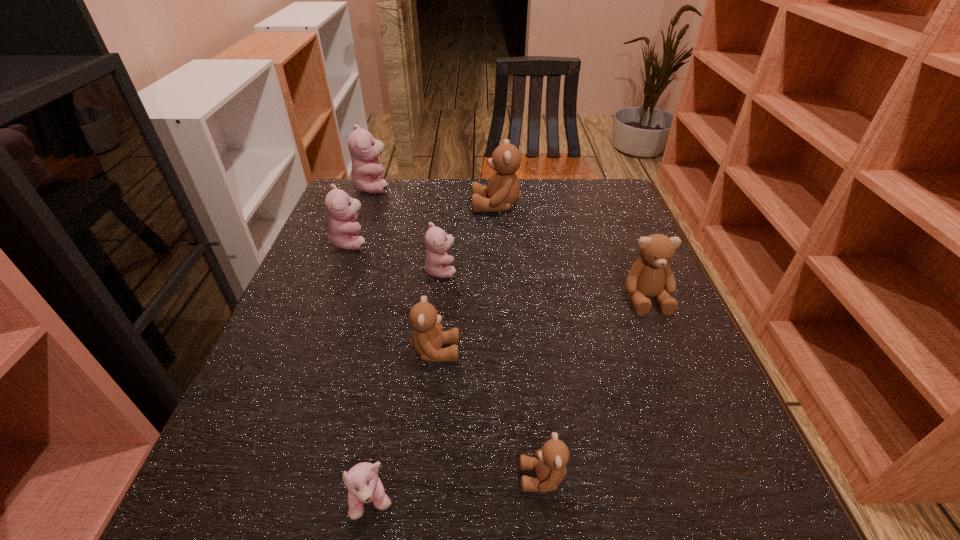
I want to click on the nearest brown teddy bear, so click(550, 462).

I want to click on the smallest pink teddy bear, so pos(364,486).

Identify the location of blank space located at the face of the farthest pink teddy bear. (472, 187).

The height and width of the screenshot is (540, 960). Identify the location of vacant space located on the front-facing side of the biggest brown teddy bear. (419, 206).

The image size is (960, 540). In order to click on vacant region located on the front-facing side of the biggest brown teddy bear in this screenshot , I will do `click(375, 206)`.

Where is `vacant space located on the front-facing side of the biggest brown teddy bear`? The width and height of the screenshot is (960, 540). vacant space located on the front-facing side of the biggest brown teddy bear is located at coordinates (425, 206).

This screenshot has width=960, height=540. Identify the location of vacant space positioned 0.220m at the face of the third farthest object. tap(457, 242).

At what (x,y) coordinates should I click in order to perform the action: click on vacant region located on the front-facing side of the rightmost brown teddy bear. Please return your answer as a coordinate pair (x, y). Looking at the image, I should click on (661, 336).

Identify the location of free region located 0.280m on the front-facing side of the sixth farthest teddy bear. The height and width of the screenshot is (540, 960). (606, 351).

Where is `vacant space located 0.160m at the face of the fifth nearest object`? vacant space located 0.160m at the face of the fifth nearest object is located at coordinates (526, 271).